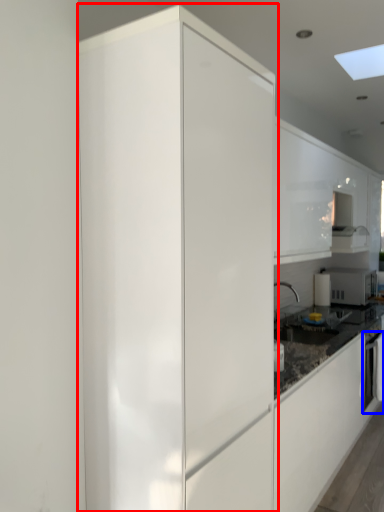
Question: Among these objects, which one is nearest to the camera, cabinetry (highlighted by a red box) or oven (highlighted by a blue box)?

Choices:
 (A) cabinetry
 (B) oven

Answer: (A)